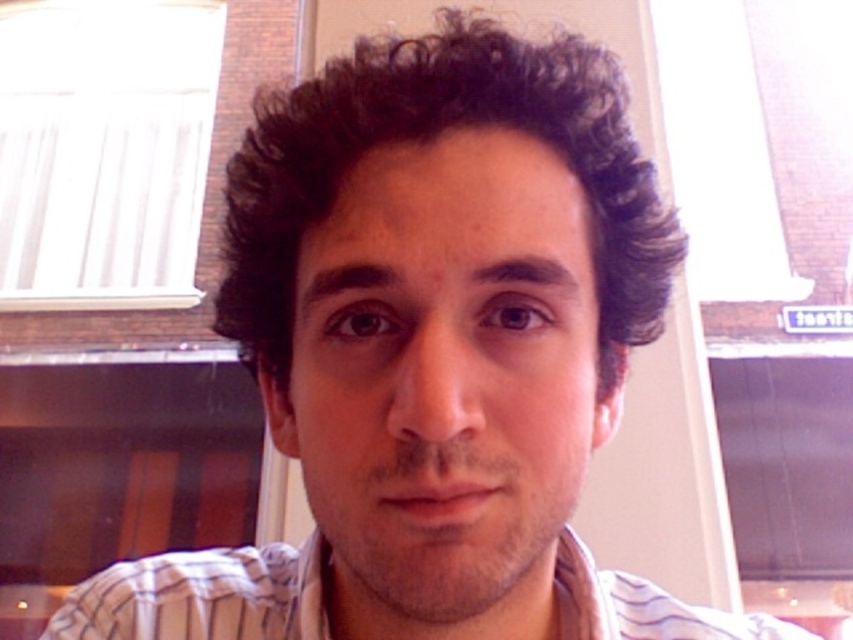
Question: Is dark curly hair at center thinner than white striped shirt at center?

Choices:
 (A) yes
 (B) no

Answer: (A)

Question: Which object appears farthest from the camera in this image?

Choices:
 (A) white striped shirt at center
 (B) dark curly hair at center

Answer: (A)

Question: Is dark curly hair at center wider than white striped shirt at center?

Choices:
 (A) yes
 (B) no

Answer: (B)

Question: Can you confirm if dark curly hair at center is thinner than white striped shirt at center?

Choices:
 (A) yes
 (B) no

Answer: (A)

Question: Among these objects, which one is nearest to the camera?

Choices:
 (A) dark curly hair at center
 (B) white striped shirt at center

Answer: (A)